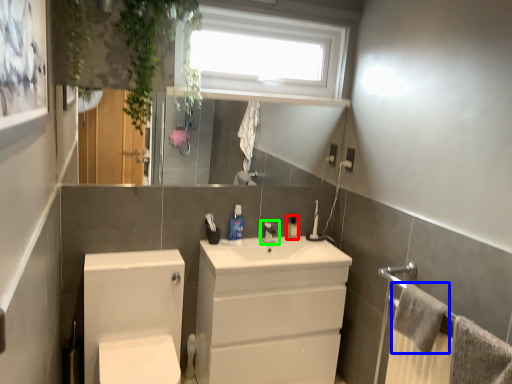
Question: Estimate the real-world distances between objects in this image. Which object is farther from toiletry (highlighted by a red box), bath towel (highlighted by a blue box) or tap (highlighted by a green box)?

Choices:
 (A) bath towel
 (B) tap

Answer: (A)